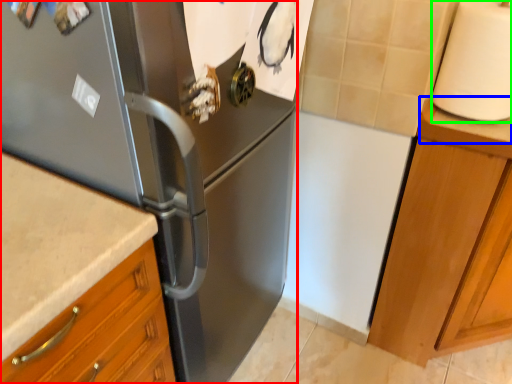
Question: Which object is positioned closest to refrigerator (highlighted by a red box)? Select from counter top (highlighted by a blue box) and paper towel (highlighted by a green box).

Choices:
 (A) counter top
 (B) paper towel

Answer: (B)